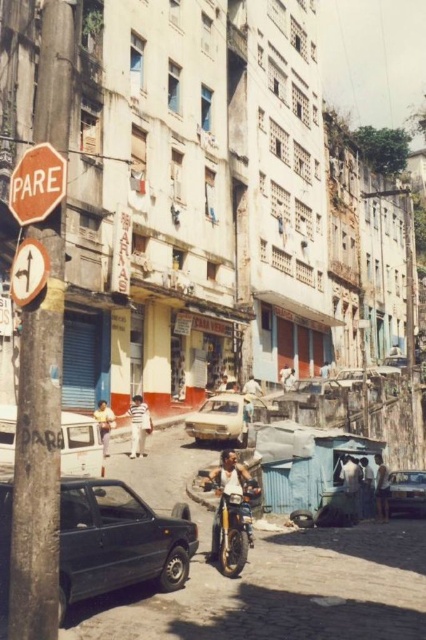
Question: Which of the following is the closest to the observer?

Choices:
 (A) dark blue shirt at center
 (B) white matte truck at lower left

Answer: (B)

Question: Does shiny chrome motorcycle at center have a lesser width compared to white striped shirt at center?

Choices:
 (A) yes
 (B) no

Answer: (B)

Question: Among these points, which one is farthest from the camera?

Choices:
 (A) (100, 412)
 (B) (347, 493)
 (C) (138, 545)
 (D) (32, 284)

Answer: (A)

Question: Where is white matte car at center located in relation to dark blue shirt at center in the image?

Choices:
 (A) below
 (B) above

Answer: (B)

Question: Which point is closer to the camera?

Choices:
 (A) (25, 252)
 (B) (345, 502)

Answer: (A)

Question: Does light blue shirt at center have a lesser width compared to light brown leather jacket at center?

Choices:
 (A) yes
 (B) no

Answer: (A)